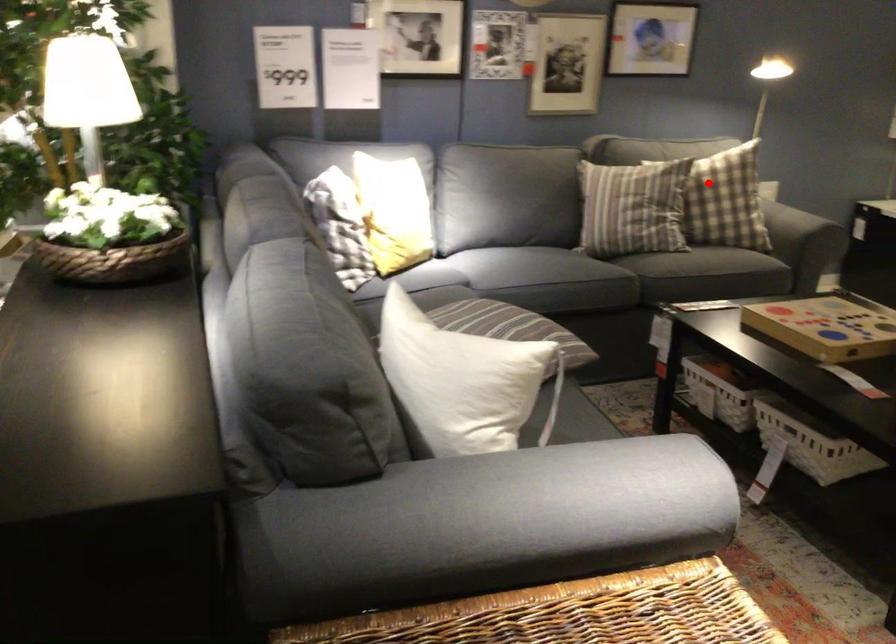
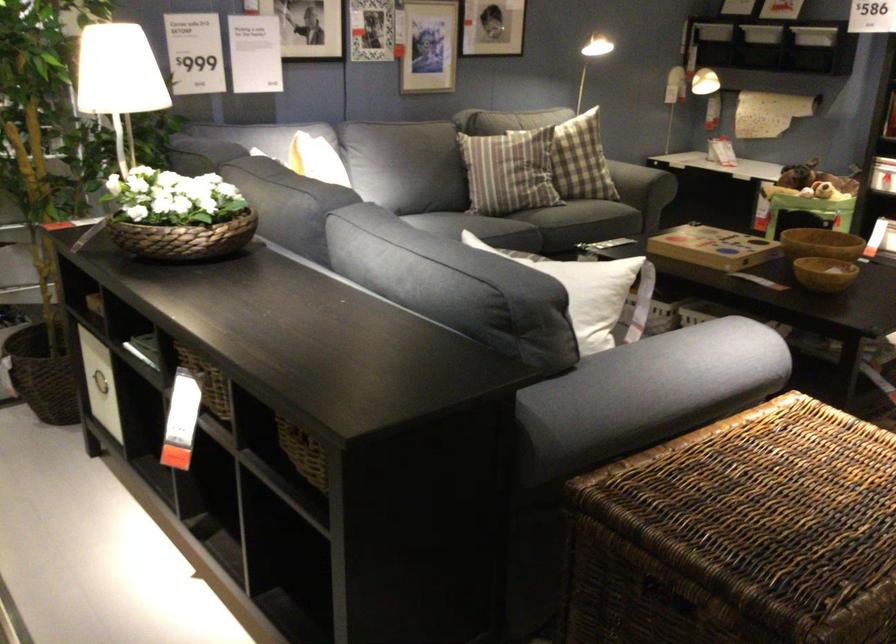
Question: A red point is marked in image1. In image2, is the corresponding 3D point closer to the camera or farther? Reply with the corresponding letter.

Choices:
 (A) The corresponding 3D point is closer.
 (B) The corresponding 3D point is farther.

Answer: (B)